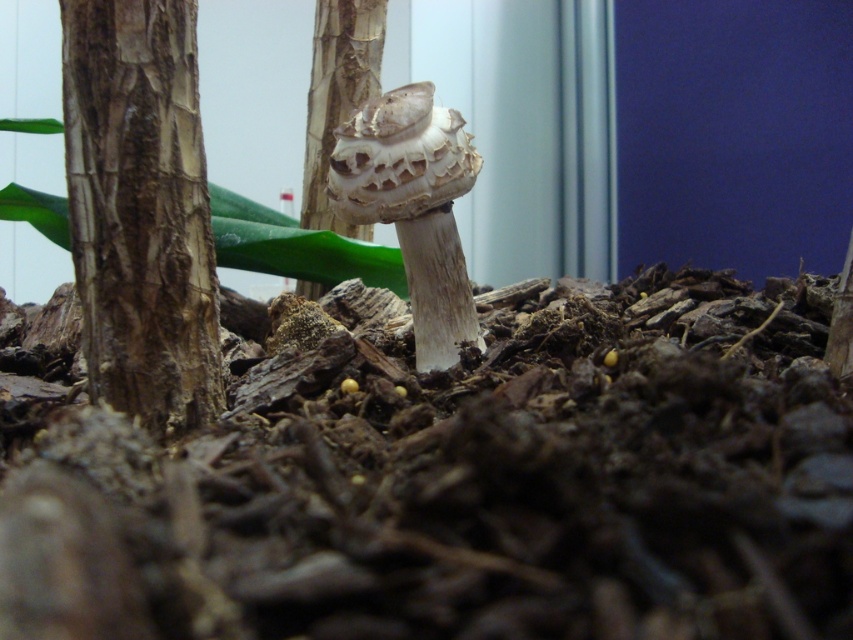
You are a gardener examining a terrarium setup. You notice the brown textured bark at left and the smooth bark tree trunk at center. Which of these two items is smaller in size?

The brown textured bark at left is smaller in size compared to the smooth bark tree trunk at center.

You are a gardener who needs to place a 30 inch ruler between the brown textured bark at left and the smooth bark tree trunk at center. Can you fit the ruler horizontally between them?

The brown textured bark at left and smooth bark tree trunk at center are 28.99 inches apart, so the 30 inch ruler cannot fit horizontally between them as the distance is shorter than the ruler.